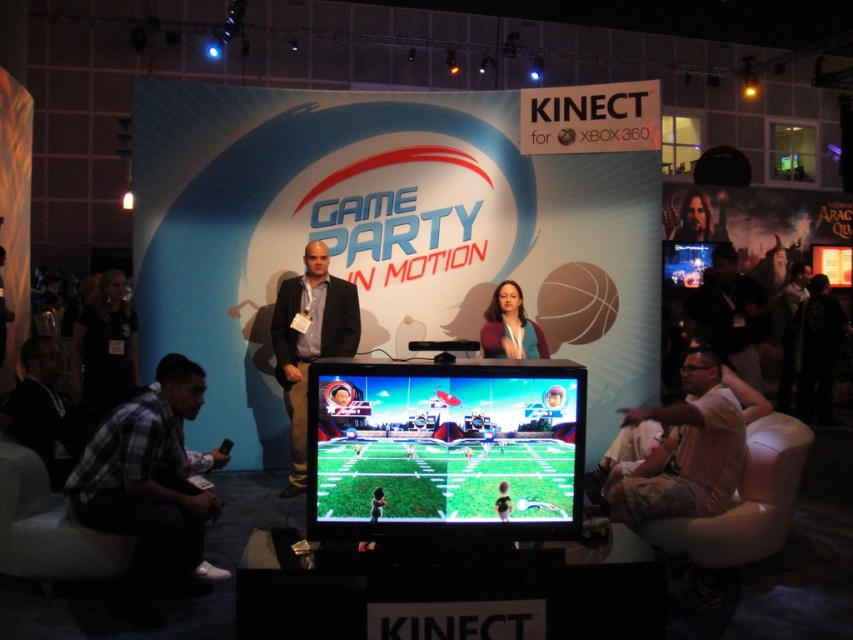
You are at a gaming event and see the dark gray shirt at right and the shiny blue screen at upper right. Which object is taller?

The dark gray shirt at right is taller than the shiny blue screen at upper right.

You are at the gaming event and want to take a photo of the plaid shirt at lower left and the matte blue shirt at center. Which shirt should you focus on first to ensure both are in clear view?

You should focus on the plaid shirt at lower left first since it is closer to the viewer than the matte blue shirt at center, ensuring both are in clear view.

From the picture: You are at the gaming event and want to find the plaid shirt at lower left. What are the coordinates where you should look?

You should look at point (148,481) to find the plaid shirt at lower left.